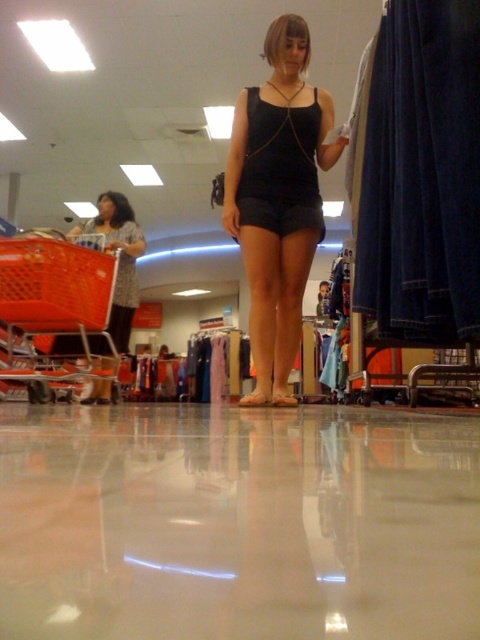
Does orange plastic shopping cart at left appear under matte brown hair at left?

Indeed, orange plastic shopping cart at left is positioned under matte brown hair at left.

Is point (28, 380) in front of point (115, 333)?

Yes.

Is point (60, 264) positioned behind point (134, 253)?

No, it is not.

I want to click on orange plastic shopping cart at left, so click(54, 308).

Find the location of a particular element. This screenshot has height=640, width=480. black matte shorts at center is located at coordinates (277, 198).

Can you confirm if black matte shorts at center is wider than matte brown hair at left?

Yes, black matte shorts at center is wider than matte brown hair at left.

Find the location of a particular element. black matte shorts at center is located at coordinates (277, 198).

Based on the photo, can you confirm if black matte shorts at center is positioned to the left of orange plastic shopping cart at left?

No, black matte shorts at center is not to the left of orange plastic shopping cart at left.

Is point (260, 241) more distant than point (11, 276)?

No, (260, 241) is closer to viewer.

At what (x,y) coordinates should I click in order to perform the action: click on black matte shorts at center. Please return your answer as a coordinate pair (x, y). The image size is (480, 640). Looking at the image, I should click on (277, 198).